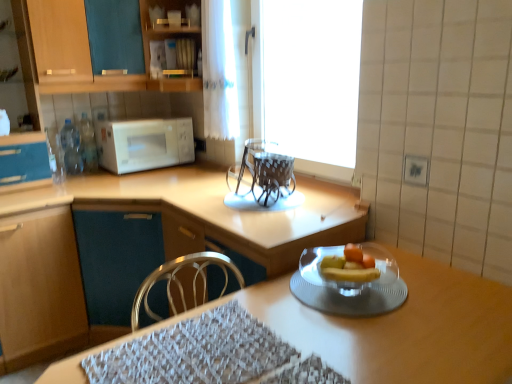
Locate an element on the screen. The height and width of the screenshot is (384, 512). wooden cabinet at upper left, acting as the 3th cabinetry starting from the bottom is located at coordinates pos(89,49).

Locate an element on the screen. The image size is (512, 384). white glossy microwave at upper left is located at coordinates (144, 144).

Image resolution: width=512 pixels, height=384 pixels. What do you see at coordinates (219, 71) in the screenshot?
I see `white sheer curtain at upper center` at bounding box center [219, 71].

What do you see at coordinates (342, 255) in the screenshot? I see `transparent glass plate at lower right` at bounding box center [342, 255].

Where is `transparent glass plate at lower right`? This screenshot has height=384, width=512. transparent glass plate at lower right is located at coordinates (342, 255).

This screenshot has height=384, width=512. Find the location of `transparent glass window at center`. transparent glass window at center is located at coordinates (308, 81).

Visually, is white sheer curtain at upper center positioned to the left or to the right of woven fabric place mat at lower center?

Based on their positions, white sheer curtain at upper center is located to the left of woven fabric place mat at lower center.

How different are the orientations of white sheer curtain at upper center and woven fabric place mat at lower center in degrees?

The angular difference between white sheer curtain at upper center and woven fabric place mat at lower center is 91.2 degrees.

Who is smaller, white sheer curtain at upper center or woven fabric place mat at lower center?

woven fabric place mat at lower center.

Locate an element on the screen. The width and height of the screenshot is (512, 384). place mat that is below the white sheer curtain at upper center (from the image's perspective) is located at coordinates (209, 355).

Is the position of white sheer curtain at upper center less distant than that of matte wood cabinet at left, which appears as the second cabinetry when ordered from the bottom?

No, it is not.

Image resolution: width=512 pixels, height=384 pixels. In order to click on cabinetry that is the 1st object located below the white sheer curtain at upper center (from the image's perspective) in this screenshot , I will do `click(164, 242)`.

Between white sheer curtain at upper center and matte wood cabinet at left, which appears as the second cabinetry when ordered from the bottom, which one has larger size?

With larger size is matte wood cabinet at left, which appears as the second cabinetry when ordered from the bottom.

Based on the photo, is white sheer curtain at upper center to the right of matte wood cabinet at left, which appears as the second cabinetry when ordered from the bottom, from the viewer's perspective?

Correct, you'll find white sheer curtain at upper center to the right of matte wood cabinet at left, which appears as the second cabinetry when ordered from the bottom.

Is wooden cabinet at upper left, which is the first cabinetry from top to bottom, inside or outside of wooden table at center?

wooden cabinet at upper left, which is the first cabinetry from top to bottom, is spatially situated outside wooden table at center.

Between wooden cabinet at upper left, acting as the 3th cabinetry starting from the bottom, and wooden table at center, which one has less height?

wooden cabinet at upper left, acting as the 3th cabinetry starting from the bottom.

From the image's perspective, is wooden cabinet at upper left, which is the first cabinetry from top to bottom, above or below wooden table at center?

From the image's perspective, wooden cabinet at upper left, which is the first cabinetry from top to bottom, appears above wooden table at center.

Is point (222, 30) closer or farther from the camera than point (310, 274)?

Point (222, 30) is positioned farther from the camera compared to point (310, 274).

The height and width of the screenshot is (384, 512). Find the location of `curtain that appears behind the transparent glass plate at lower right`. curtain that appears behind the transparent glass plate at lower right is located at coordinates (219, 71).

Between white sheer curtain at upper center and transparent glass plate at lower right, which one is positioned in front?

transparent glass plate at lower right is more forward.

Is white sheer curtain at upper center outside of transparent glass plate at lower right?

Absolutely, white sheer curtain at upper center is external to transparent glass plate at lower right.

How many degrees apart are the facing directions of matte wood cabinet at lower left, which is the third cabinetry from top to bottom, and wooden cabinet at upper left, acting as the 3th cabinetry starting from the bottom?

1.04 degrees.

Considering the sizes of objects matte wood cabinet at lower left, which is the 1th cabinetry from bottom to top, and wooden cabinet at upper left, which is the first cabinetry from top to bottom, in the image provided, who is bigger, matte wood cabinet at lower left, which is the 1th cabinetry from bottom to top, or wooden cabinet at upper left, which is the first cabinetry from top to bottom,?

With larger size is matte wood cabinet at lower left, which is the 1th cabinetry from bottom to top.

Is matte wood cabinet at lower left, which is the 1th cabinetry from bottom to top, aimed at wooden cabinet at upper left, acting as the 3th cabinetry starting from the bottom?

No, matte wood cabinet at lower left, which is the 1th cabinetry from bottom to top, is not oriented towards wooden cabinet at upper left, acting as the 3th cabinetry starting from the bottom.

Considering the positions of points (218, 16) and (73, 381), is point (218, 16) farther from camera compared to point (73, 381)?

Yes, it is.

Between white sheer curtain at upper center and wooden table at center, which one has more height?

Standing taller between the two is white sheer curtain at upper center.

In the image, is white sheer curtain at upper center on the left side or the right side of wooden table at center?

Clearly, white sheer curtain at upper center is on the left of wooden table at center in the image.

Identify the location of table in front of the white sheer curtain at upper center. (379, 330).

Considering the relative sizes of transparent glass window at center and white sheer curtain at upper center in the image provided, is transparent glass window at center shorter than white sheer curtain at upper center?

No, transparent glass window at center is not shorter than white sheer curtain at upper center.

Considering the sizes of objects transparent glass window at center and white sheer curtain at upper center in the image provided, who is wider, transparent glass window at center or white sheer curtain at upper center?

With larger width is white sheer curtain at upper center.

Which of these two, transparent glass window at center or white sheer curtain at upper center, is smaller?

With smaller size is white sheer curtain at upper center.

Is point (351, 31) positioned in front of point (222, 22)?

No, (351, 31) is behind (222, 22).

I want to click on curtain above the woven fabric place mat at lower center (from a real-world perspective), so click(x=219, y=71).

Where is `curtain behind the matte wood cabinet at left, which ranks as the second cabinetry in top-to-bottom order`? Image resolution: width=512 pixels, height=384 pixels. curtain behind the matte wood cabinet at left, which ranks as the second cabinetry in top-to-bottom order is located at coordinates (219, 71).

Looking at the image, which one is located further to transparent glass plate at lower right, matte wood cabinet at left, which ranks as the second cabinetry in top-to-bottom order, or woven fabric place mat at lower center?

Among the two, matte wood cabinet at left, which ranks as the second cabinetry in top-to-bottom order, is located further to transparent glass plate at lower right.

Considering their positions, is white glossy microwave at upper left positioned closer to wooden table at center than transparent glass window at center?

The object closer to wooden table at center is white glossy microwave at upper left.

When comparing their distances from matte wood cabinet at lower left, which is the 1th cabinetry from bottom to top, does white glossy microwave at upper left or white sheer curtain at upper center seem further?

white sheer curtain at upper center is further to matte wood cabinet at lower left, which is the 1th cabinetry from bottom to top.

Which object lies nearer to the anchor point white sheer curtain at upper center, wooden cabinet at upper left, which is the first cabinetry from top to bottom, or white glossy microwave at upper left?

wooden cabinet at upper left, which is the first cabinetry from top to bottom, is positioned closer to the anchor white sheer curtain at upper center.

Considering their positions, is white sheer curtain at upper center positioned further to wooden cabinet at upper left, which is the first cabinetry from top to bottom, than wooden table at center?

The object further to wooden cabinet at upper left, which is the first cabinetry from top to bottom, is wooden table at center.

Considering their positions, is woven fabric place mat at lower center positioned further to matte wood cabinet at left, which appears as the second cabinetry when ordered from the bottom, than transparent glass plate at lower right?

woven fabric place mat at lower center is positioned further to the anchor matte wood cabinet at left, which appears as the second cabinetry when ordered from the bottom.

Which object lies nearer to the anchor point white glossy microwave at upper left, transparent glass plate at lower right or matte wood cabinet at lower left, which is the 1th cabinetry from bottom to top?

Among the two, matte wood cabinet at lower left, which is the 1th cabinetry from bottom to top, is located nearer to white glossy microwave at upper left.

Estimate the real-world distances between objects in this image. Which object is further from matte wood cabinet at lower left, which is the 1th cabinetry from bottom to top, transparent glass window at center or white glossy microwave at upper left?

Among the two, transparent glass window at center is located further to matte wood cabinet at lower left, which is the 1th cabinetry from bottom to top.

At what (x,y) coordinates should I click in order to perform the action: click on curtain between woven fabric place mat at lower center and white glossy microwave at upper left along the z-axis. Please return your answer as a coordinate pair (x, y). Image resolution: width=512 pixels, height=384 pixels. Looking at the image, I should click on (219, 71).

At what (x,y) coordinates should I click in order to perform the action: click on window between wooden table at center and matte wood cabinet at left, which appears as the second cabinetry when ordered from the bottom, from front to back. Please return your answer as a coordinate pair (x, y). The width and height of the screenshot is (512, 384). Looking at the image, I should click on (308, 81).

Locate an element on the screen. This screenshot has height=384, width=512. place mat between wooden table at center and white sheer curtain at upper center in the front-back direction is located at coordinates (209, 355).

Locate an element on the screen. microwave oven between matte wood cabinet at lower left, which is the 1th cabinetry from bottom to top, and transparent plastic chairs at center is located at coordinates [144, 144].